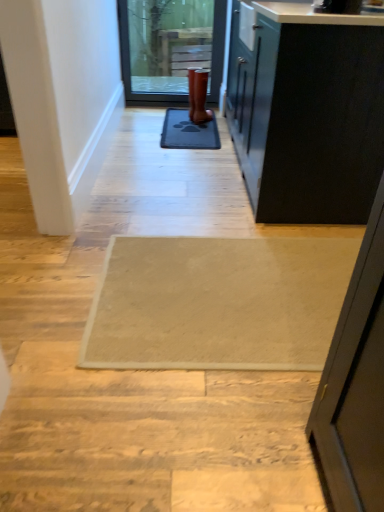
This screenshot has width=384, height=512. Identify the location of vacant area situated below white smooth door at left (from a real-world perspective). (36, 286).